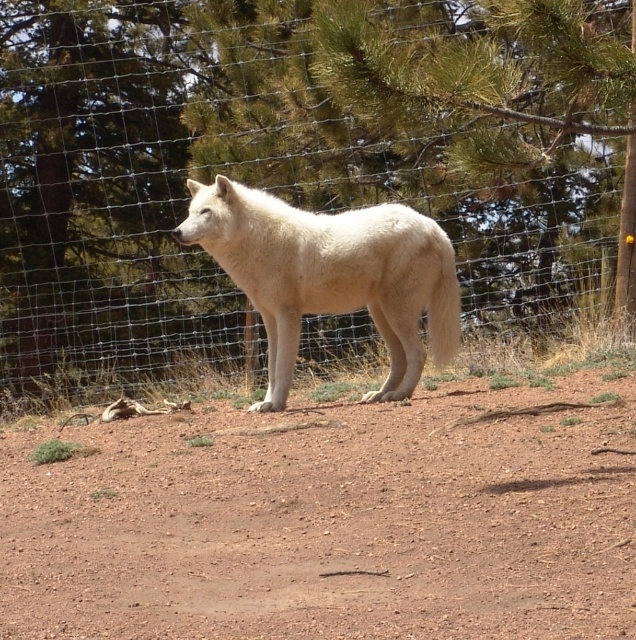
Does brown dirt track at center lie behind white fur wolf at center?

No.

Can you confirm if brown dirt track at center is positioned below white fur wolf at center?

Yes.

Between point (417, 620) and point (378, 260), which one is positioned in front?

Point (417, 620) is more forward.

The height and width of the screenshot is (640, 636). I want to click on brown dirt track at center, so click(x=329, y=520).

Is point (560, 35) positioned after point (31, 589)?

Yes, point (560, 35) is farther from viewer.

Which is in front, point (31, 122) or point (130, 449)?

Point (130, 449) is in front.

This screenshot has width=636, height=640. What are the coordinates of `wire mesh fence at center` in the screenshot? It's located at (300, 166).

Which is in front, point (284, 17) or point (415, 294)?

Point (415, 294) is in front.

In order to click on wire mesh fence at center in this screenshot , I will do `click(300, 166)`.